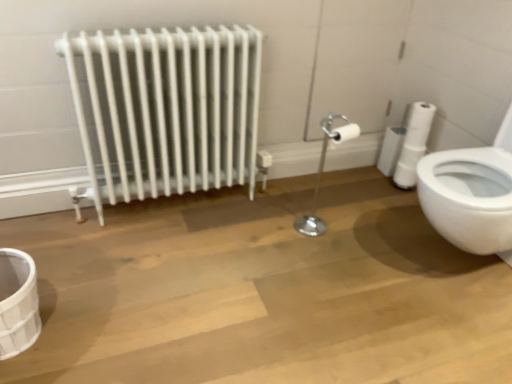
Where is `free spot below white metallic radiator at left (from a real-world perspective)`? Image resolution: width=512 pixels, height=384 pixels. free spot below white metallic radiator at left (from a real-world perspective) is located at coordinates (180, 204).